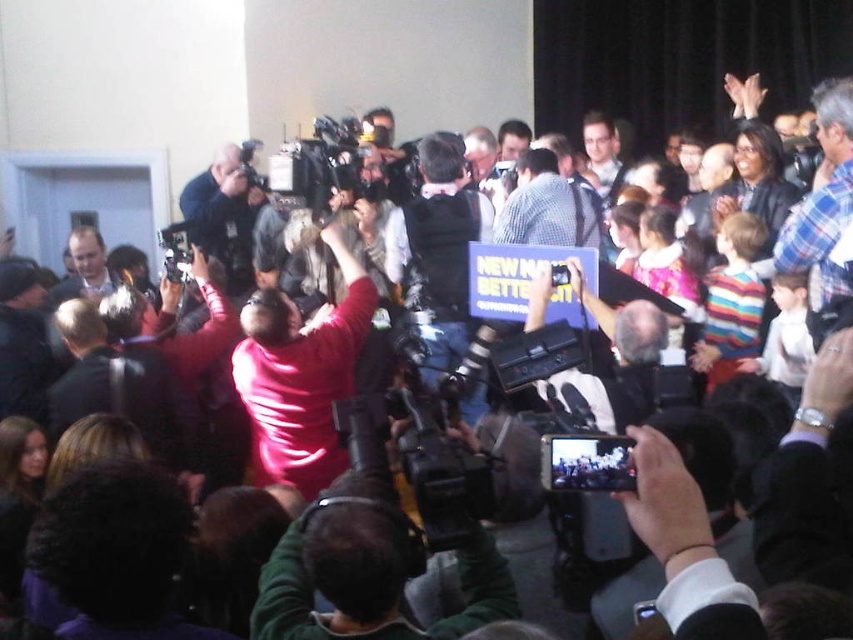
You are a photographer at the event and want to capture a clear shot of the matte pink shirt at center without the black plastic video camera at center blocking the view. Based on their relative heights, can you position yourself so that the shirt is visible above the camera?

The matte pink shirt at center is much taller than the black plastic video camera at center, so positioning yourself at a lower angle could allow the shirt to be visible above the camera.

You are a photographer at the event and need to focus your camera on the person with the matte pink shirt at center. There is also a black plastic video camera at center in the way. Can you adjust your angle to capture the person without the camera blocking the view?

The matte pink shirt at center is further to the viewer than the black plastic video camera at center, so adjusting the angle slightly downward should allow you to capture the person without the camera blocking the view.